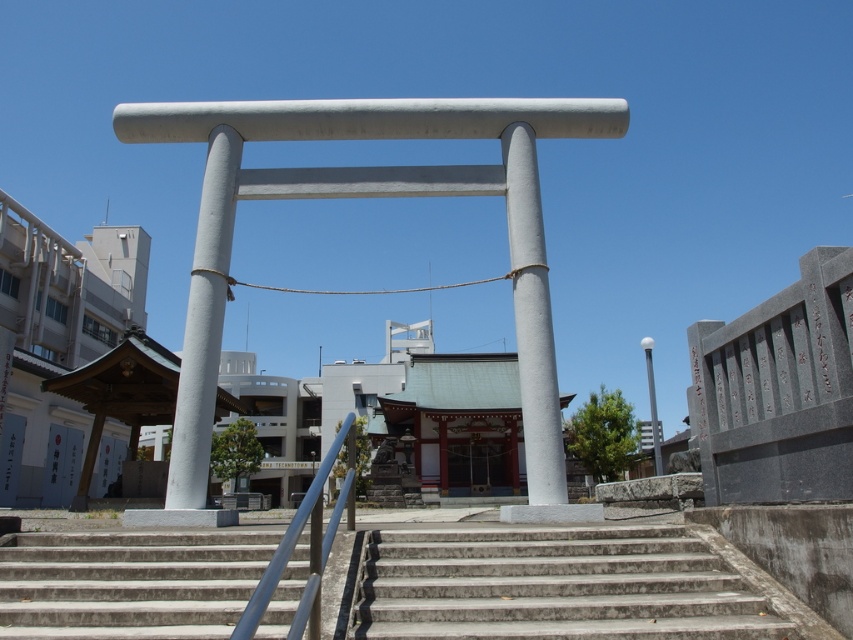
Question: Which object appears closest to the camera in this image?

Choices:
 (A) smooth gray pole at right
 (B) smooth concrete pillar at center
 (C) smooth concrete pillar at left
 (D) concrete stairs at center

Answer: (D)

Question: Is the position of gray concrete stairs at center more distant than that of smooth concrete pillar at left?

Choices:
 (A) yes
 (B) no

Answer: (B)

Question: Can you confirm if gray concrete stairs at center is smaller than smooth gray pole at right?

Choices:
 (A) no
 (B) yes

Answer: (B)

Question: Which of the following is the closest to the observer?

Choices:
 (A) (206, 308)
 (B) (199, 561)
 (C) (654, 397)

Answer: (B)

Question: Is concrete stairs at center thinner than smooth concrete pillar at left?

Choices:
 (A) yes
 (B) no

Answer: (A)

Question: Estimate the real-world distances between objects in this image. Which object is closer to the smooth concrete pillar at center?

Choices:
 (A) concrete stairs at center
 (B) smooth gray pole at right
 (C) smooth concrete pillar at left
 (D) gray concrete stairs at center

Answer: (D)